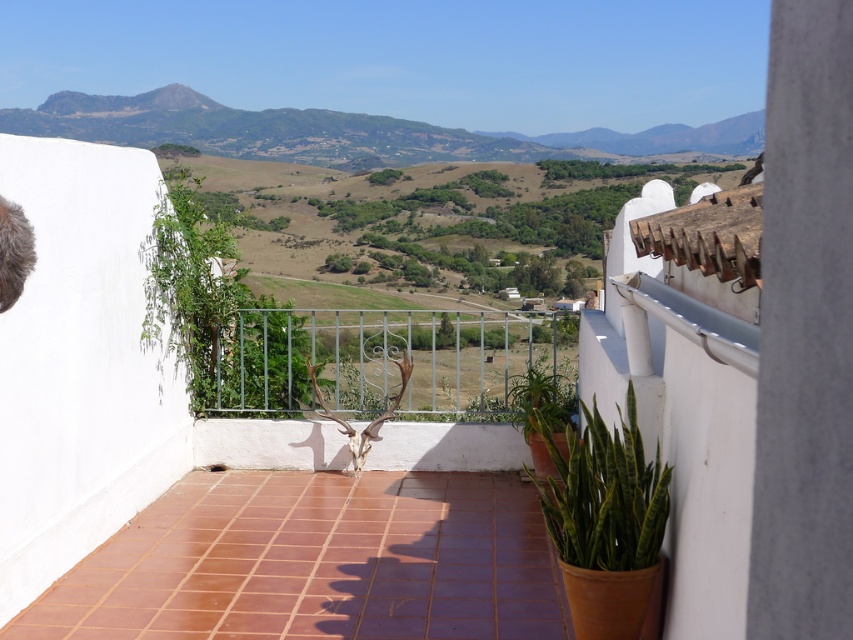
You are standing on the balcony and want to place a 1.5 meter long bench between the rugged brown mountain at upper center and the green glossy snake plant at lower right. Is there enough space for the bench?

The distance between the rugged brown mountain at upper center and the green glossy snake plant at lower right is 12.44 meters, so yes, the bench can be placed between them since the space is sufficient.

You are standing on the balcony and want to place a small decorative statue between the rugged brown mountain at upper center and the green glossy snake plant at lower right. Which object should you place it closer to to ensure it fits within the space?

The rugged brown mountain at upper center is wider than the green glossy snake plant at lower right. Therefore, placing the statue closer to the rugged brown mountain at upper center would ensure it fits within the available space.